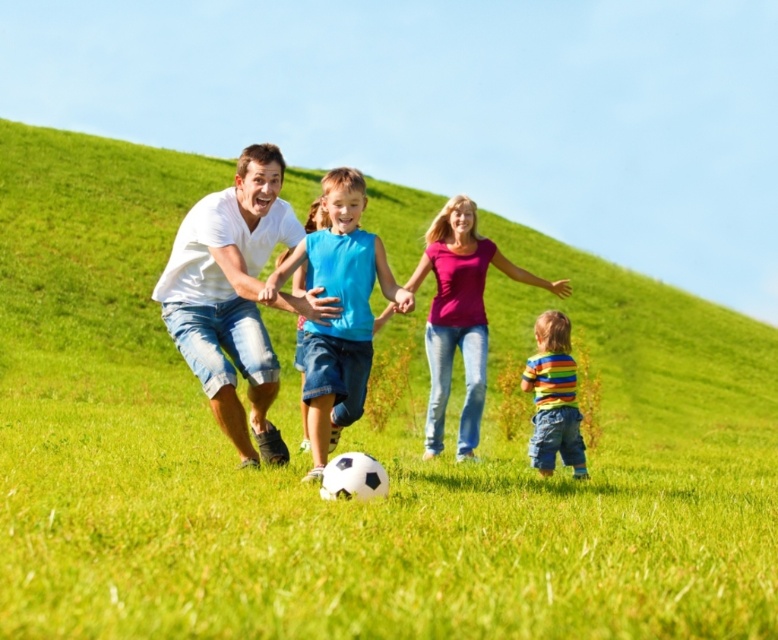
You are a photographer trying to capture a photo of the white matte shirt at center and the blue denim shorts at center. Since you want to ensure both are in focus, you need to know which one is taller. Can you tell me which object is taller?

The white matte shirt at center is much taller than the blue denim shorts at center according to the description.

Based on the photo, you are a photographer trying to capture a photo of both the white matte shirt at center and the striped cotton shirt at lower right. Since you can only focus on one subject at a time, which shirt should you focus on to ensure the other is still in the background?

You should focus on the white matte shirt at center because it is located above the striped cotton shirt at lower right, so the striped cotton shirt at lower right will naturally appear in the background.

You are a photographer trying to capture a group photo of the family. You notice the white cotton shirt at center and the striped cotton shirt at lower right. Which shirt should you focus on to ensure the subject wearing it is more prominent in the photo?

The white cotton shirt at center should be focused on because its width is larger than the striped cotton shirt at lower right, making it more noticeable in the photo.